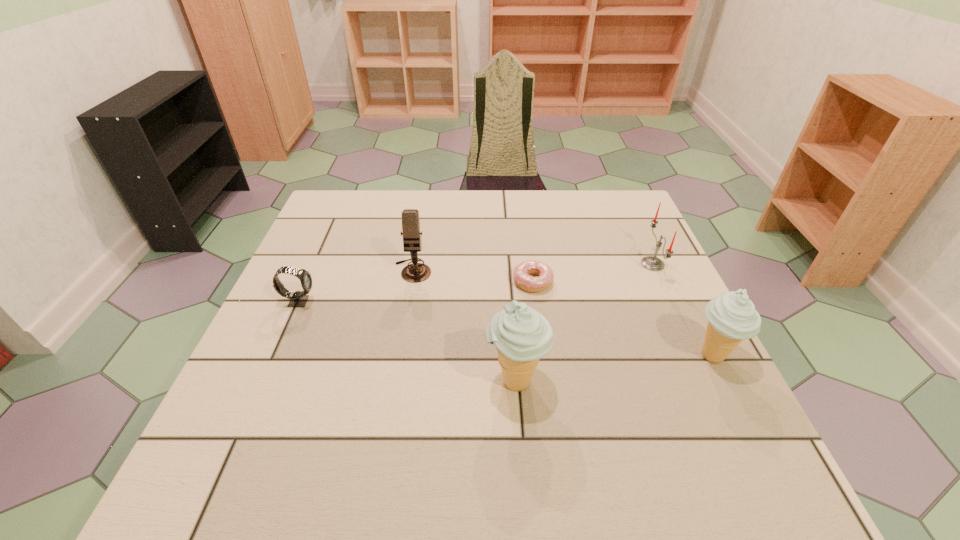
At what (x,y) coordinates should I click in order to perform the action: click on the left icecream. Please return your answer as a coordinate pair (x, y). The image size is (960, 540). Looking at the image, I should click on (521, 335).

Where is `the taller icecream`? the taller icecream is located at coordinates (x=521, y=335).

Identify the location of the shorter icecream. (732, 317).

You are a GUI agent. You are given a task and a screenshot of the screen. Output one action in this format:
    pyautogui.click(x=<x>, y=<y>)
    Task: Click on the fourth tallest object
    The height and width of the screenshot is (540, 960).
    Given the screenshot: What is the action you would take?
    pyautogui.click(x=652, y=263)

Identify the location of the fifth object from right to left. The image size is (960, 540). (417, 272).

The image size is (960, 540). I want to click on watch, so click(x=298, y=298).

Identify the location of the leftmost object. (298, 298).

The width and height of the screenshot is (960, 540). I want to click on doughnut, so click(522, 278).

This screenshot has width=960, height=540. What are the coordinates of `vacant space located on the right of the tallest object` in the screenshot? It's located at point(675,381).

You are a GUI agent. You are given a task and a screenshot of the screen. Output one action in this format:
    pyautogui.click(x=<x>, y=<y>)
    Task: Click on the vacant space positioned 0.230m on the left of the right icecream
    This screenshot has height=540, width=960.
    Given the screenshot: What is the action you would take?
    pyautogui.click(x=577, y=355)